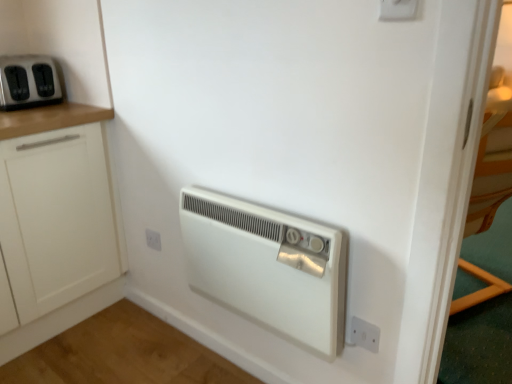
Question: Can you confirm if white plastic electric outlet at lower center, which appears as the first electric outlet when viewed from the back, is thinner than matte black toaster at upper left, positioned as the 2th home appliance in right-to-left order?

Choices:
 (A) yes
 (B) no

Answer: (A)

Question: Does white plastic electric outlet at lower center, which ranks as the 2th electric outlet in bottom-to-top order, have a greater height compared to matte black toaster at upper left, acting as the 2th home appliance starting from the front?

Choices:
 (A) yes
 (B) no

Answer: (B)

Question: Is white plastic electric outlet at lower center, which appears as the first electric outlet when viewed from the back, shorter than matte black toaster at upper left, the second home appliance positioned from the bottom?

Choices:
 (A) no
 (B) yes

Answer: (B)

Question: Does white plastic electric outlet at lower center, which ranks as the 2th electric outlet in bottom-to-top order, turn towards matte black toaster at upper left, acting as the 2th home appliance starting from the front?

Choices:
 (A) yes
 (B) no

Answer: (B)

Question: Does white plastic electric outlet at lower center, the 3th electric outlet when ordered from right to left, have a larger size compared to matte black toaster at upper left, placed as the 1th home appliance when sorted from top to bottom?

Choices:
 (A) yes
 (B) no

Answer: (B)

Question: Does point (322, 324) appear closer or farther from the camera than point (102, 205)?

Choices:
 (A) closer
 (B) farther

Answer: (A)

Question: Would you say white plastic heater at center, arranged as the 2th home appliance when viewed from the top, is inside or outside white matte cabinet at left?

Choices:
 (A) outside
 (B) inside

Answer: (A)

Question: In terms of height, does white plastic heater at center, which appears as the first home appliance when viewed from the right, look taller or shorter compared to white matte cabinet at left?

Choices:
 (A) short
 (B) tall

Answer: (A)

Question: Is white plastic heater at center, the 2th home appliance from the back, wider or thinner than white matte cabinet at left?

Choices:
 (A) wide
 (B) thin

Answer: (B)

Question: From a real-world perspective, is white plastic electric outlet at lower right, the 2th electric outlet when ordered from front to back, physically located above or below white matte cabinet at left?

Choices:
 (A) below
 (B) above

Answer: (A)

Question: Does point (374, 345) appear closer or farther from the camera than point (59, 253)?

Choices:
 (A) closer
 (B) farther

Answer: (A)

Question: Is white plastic electric outlet at lower right, acting as the 2th electric outlet starting from the back, to the left or to the right of white matte cabinet at left in the image?

Choices:
 (A) right
 (B) left

Answer: (A)

Question: Considering the positions of white plastic electric outlet at lower right, placed as the third electric outlet when sorted from top to bottom, and white matte cabinet at left in the image, is white plastic electric outlet at lower right, placed as the third electric outlet when sorted from top to bottom, taller or shorter than white matte cabinet at left?

Choices:
 (A) tall
 (B) short

Answer: (B)

Question: Is white plastic electric outlet at lower center, acting as the second electric outlet starting from the top, inside the boundaries of matte black toaster at upper left, acting as the 1th home appliance starting from the left, or outside?

Choices:
 (A) outside
 (B) inside

Answer: (A)

Question: From a real-world perspective, is white plastic electric outlet at lower center, acting as the second electric outlet starting from the top, above or below matte black toaster at upper left, acting as the 2th home appliance starting from the front?

Choices:
 (A) below
 (B) above

Answer: (A)